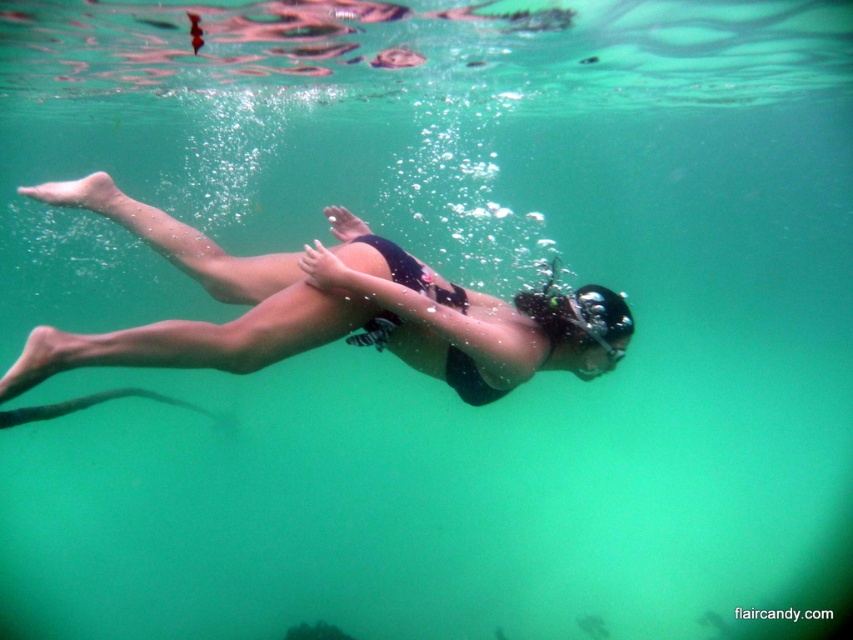
Question: Can you confirm if black matte swimsuit at center is thinner than transparent rubber goggles at center?

Choices:
 (A) yes
 (B) no

Answer: (B)

Question: Is the position of black matte swimsuit at center more distant than that of transparent rubber goggles at center?

Choices:
 (A) no
 (B) yes

Answer: (A)

Question: Among these points, which one is nearest to the camera?

Choices:
 (A) (x=590, y=298)
 (B) (x=163, y=346)

Answer: (B)

Question: Is the position of black matte swimsuit at center less distant than that of transparent rubber goggles at center?

Choices:
 (A) no
 (B) yes

Answer: (B)

Question: Which point is closer to the camera?

Choices:
 (A) black matte swimsuit at center
 (B) transparent rubber goggles at center

Answer: (A)